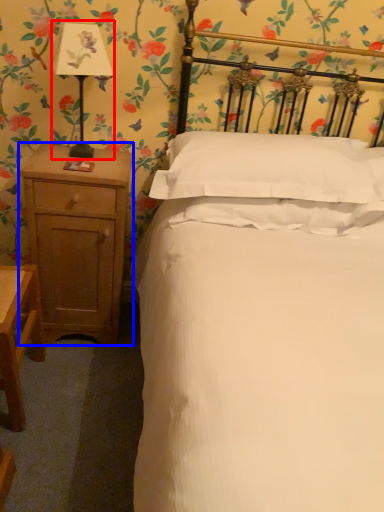
Question: Which object appears closest to the camera in this image, bedside lamp (highlighted by a red box) or nightstand (highlighted by a blue box)?

Choices:
 (A) bedside lamp
 (B) nightstand

Answer: (A)